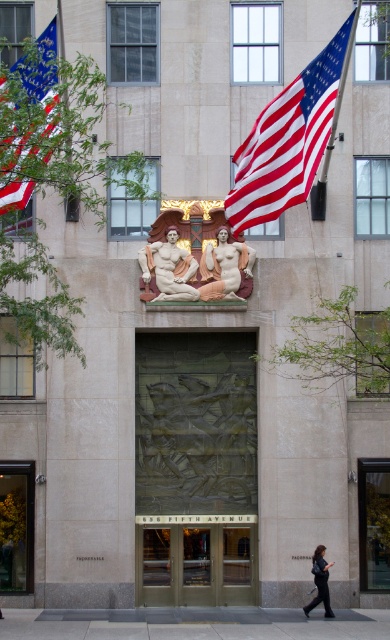
From the picture: You are standing at the entrance of the building at 636 Fifth Avenue and notice two objects near the entrance. The first is the bronze relief sculpture at center and the second is the dark gray pants at lower center. Which object is located higher up?

The bronze relief sculpture at center is positioned over the dark gray pants at lower center, so it is located higher up.

You are standing at the entrance of the building at 636 Fifth Avenue. You notice the bronze door at center and the blue fabric flag at upper left. Which object is closer to you from your current position?

The bronze door at center is closer to you because the blue fabric flag at upper left is behind it.